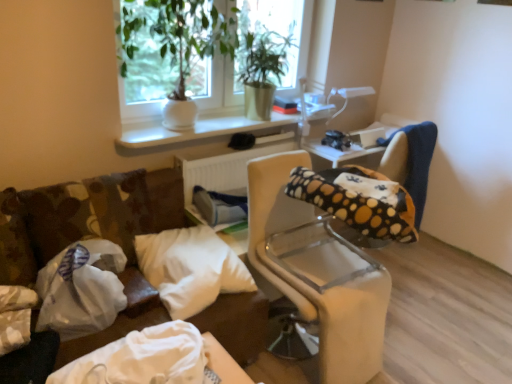
Question: Is white plastic radiator at center not inside polka dot fabric bean bag chair at right?

Choices:
 (A) no
 (B) yes

Answer: (B)

Question: Can you confirm if white plastic radiator at center is taller than polka dot fabric bean bag chair at right?

Choices:
 (A) no
 (B) yes

Answer: (A)

Question: Considering the relative sizes of white plastic radiator at center and polka dot fabric bean bag chair at right in the image provided, is white plastic radiator at center bigger than polka dot fabric bean bag chair at right?

Choices:
 (A) no
 (B) yes

Answer: (A)

Question: Is white plastic radiator at center shorter than polka dot fabric bean bag chair at right?

Choices:
 (A) no
 (B) yes

Answer: (B)

Question: Is white plastic radiator at center turned away from polka dot fabric bean bag chair at right?

Choices:
 (A) yes
 (B) no

Answer: (B)

Question: From a real-world perspective, is white fabric bag at lower left above or below white plastic radiator at center?

Choices:
 (A) below
 (B) above

Answer: (A)

Question: Is point (129, 339) positioned closer to the camera than point (242, 160)?

Choices:
 (A) farther
 (B) closer

Answer: (B)

Question: From the image's perspective, is white fabric bag at lower left above or below white plastic radiator at center?

Choices:
 (A) above
 (B) below

Answer: (B)

Question: In terms of height, does white fabric bag at lower left look taller or shorter compared to white plastic radiator at center?

Choices:
 (A) tall
 (B) short

Answer: (B)

Question: Is green leafy plant at upper center bigger or smaller than green matte plant at upper center?

Choices:
 (A) big
 (B) small

Answer: (A)

Question: Is green leafy plant at upper center to the left or to the right of green matte plant at upper center in the image?

Choices:
 (A) left
 (B) right

Answer: (A)

Question: Is green leafy plant at upper center wider or thinner than green matte plant at upper center?

Choices:
 (A) thin
 (B) wide

Answer: (B)

Question: From the image's perspective, is green leafy plant at upper center above or below green matte plant at upper center?

Choices:
 (A) below
 (B) above

Answer: (A)

Question: Considering the positions of green leafy plant at upper center and white soft pillow at center in the image, is green leafy plant at upper center taller or shorter than white soft pillow at center?

Choices:
 (A) short
 (B) tall

Answer: (B)

Question: Is green leafy plant at upper center in front of or behind white soft pillow at center in the image?

Choices:
 (A) front
 (B) behind

Answer: (B)